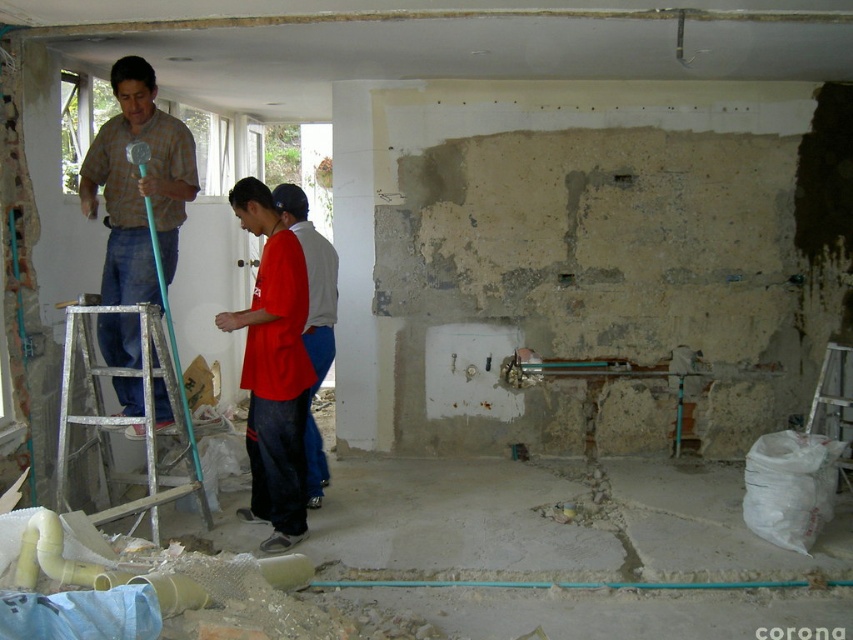
Question: Can you confirm if white concrete pillar at center is positioned to the right of white plastic ladder at center right?

Choices:
 (A) no
 (B) yes

Answer: (A)

Question: Based on their relative distances, which object is nearer to the plaid shirt at upper left?

Choices:
 (A) red matte shirt at center
 (B) silver metallic ladder at lower left
 (C) white concrete pillar at center

Answer: (B)

Question: Is matte red shirt at center bigger than red matte shirt at center?

Choices:
 (A) no
 (B) yes

Answer: (B)

Question: Does matte red shirt at center appear on the left side of silver metallic ladder at lower left?

Choices:
 (A) no
 (B) yes

Answer: (A)

Question: Which of the following is the farthest from the observer?

Choices:
 (A) (138, 204)
 (B) (839, 412)
 (C) (90, 314)
 (D) (306, 387)

Answer: (B)

Question: Among these objects, which one is nearest to the camera?

Choices:
 (A) white plastic ladder at center right
 (B) matte red shirt at center
 (C) plaid shirt at upper left
 (D) silver metallic ladder at lower left

Answer: (D)